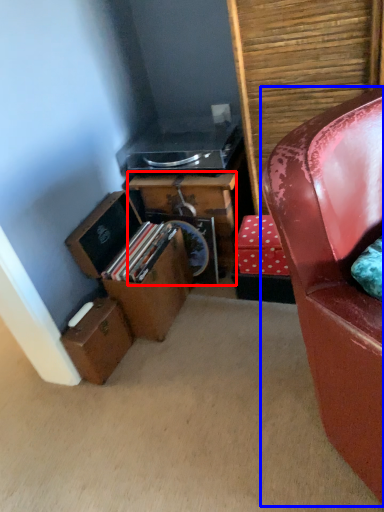
Question: Among these objects, which one is farthest to the camera, desk (highlighted by a red box) or chair (highlighted by a blue box)?

Choices:
 (A) desk
 (B) chair

Answer: (A)